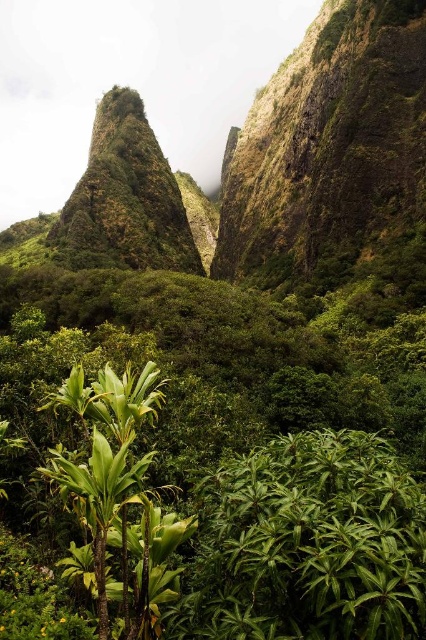
Looking at this image, who is positioned more to the left, green mossy rock at upper center or green mossy rock at center?

green mossy rock at center is more to the left.

Is green mossy rock at upper center further to camera compared to green mossy rock at center?

No, it is not.

You are a GUI agent. You are given a task and a screenshot of the screen. Output one action in this format:
    pyautogui.click(x=<x>, y=<y>)
    Task: Click on the green mossy rock at upper center
    Image resolution: width=426 pixels, height=640 pixels.
    Given the screenshot: What is the action you would take?
    (328, 144)

Which of these two, green mossy rock at center or green leafy plant at lower left, stands taller?

Standing taller between the two is green mossy rock at center.

Between green mossy rock at center and green leafy plant at lower left, which one appears on the right side from the viewer's perspective?

green leafy plant at lower left

Find the location of a particular element. green mossy rock at center is located at coordinates coord(124,198).

Find the location of `green mossy rock at center`. green mossy rock at center is located at coordinates (124, 198).

Describe the element at coordinates (328, 144) in the screenshot. I see `green mossy rock at upper center` at that location.

Can you confirm if green mossy rock at upper center is smaller than green leafy plant at lower left?

Incorrect, green mossy rock at upper center is not smaller in size than green leafy plant at lower left.

Measure the distance between green mossy rock at upper center and camera.

They are 92.67 meters apart.

The height and width of the screenshot is (640, 426). I want to click on green mossy rock at upper center, so click(x=328, y=144).